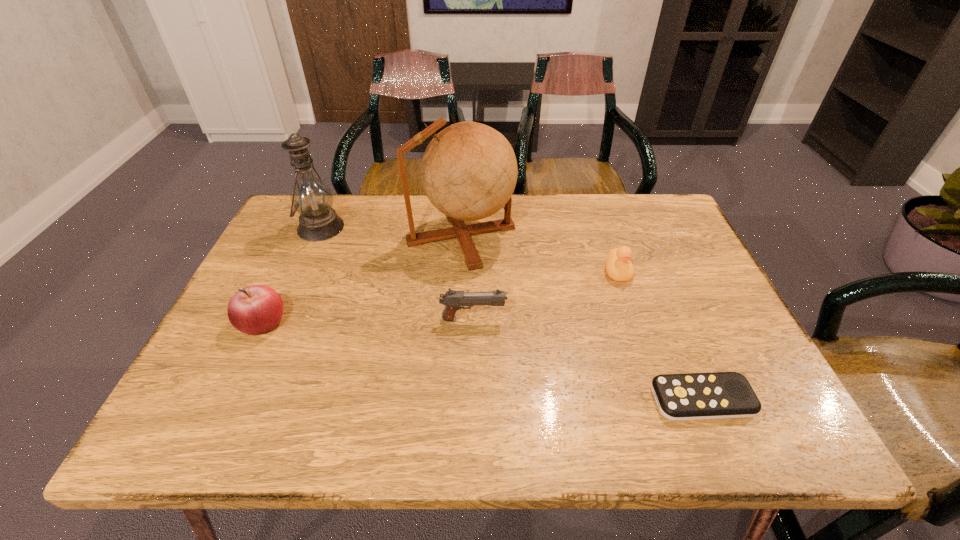
Where is `globe`? The width and height of the screenshot is (960, 540). globe is located at coordinates (469, 171).

Locate an element on the screen. oil lamp is located at coordinates (312, 198).

Where is `apple`? apple is located at coordinates (253, 310).

This screenshot has height=540, width=960. I want to click on gun, so click(453, 300).

Where is `duck`? duck is located at coordinates (619, 267).

Find the location of a particular element. The image size is (960, 540). remote control is located at coordinates (716, 395).

Image resolution: width=960 pixels, height=540 pixels. I want to click on the shortest object, so click(716, 395).

This screenshot has height=540, width=960. What are the coordinates of `vacant space positioned 0.120m on the surface of the tallest object` in the screenshot? It's located at (558, 235).

Find the location of a particular element. free spot located 0.370m on the front of the second tallest object is located at coordinates (263, 358).

This screenshot has height=540, width=960. Find the location of `vacant space located on the right of the apple`. vacant space located on the right of the apple is located at coordinates (357, 322).